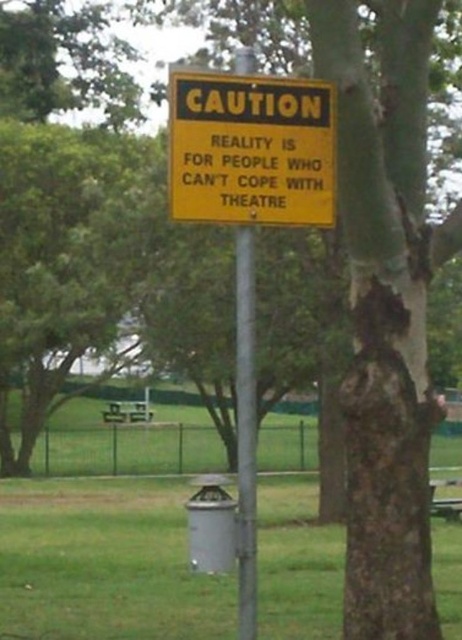
You are a park visitor who wants to attach a small note to the yellow paper sign at center. You have a 75 cm long ribbon. If you tie one end of the ribbon to the metallic pole at center, will the ribbon be long enough to reach the sign?

The yellow paper sign at center is 76.38 centimeters away from the metallic pole at center. Since the ribbon is only 75 cm long, it will be 1.38 centimeters short of reaching the sign.

You are standing in front of the caution sign and want to take a photo of both the point at coordinates point (295, 131) and the point at coordinates point (241, 362). Which point should you focus on first to ensure both are in sharp focus?

You should focus on point (295, 131) first because it is closer to the camera than point (241, 362), ensuring both points are within the depth of field.